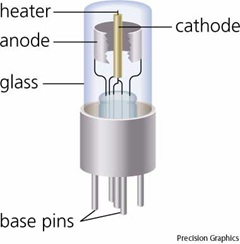
Image resolution: width=240 pixels, height=244 pixels. Find the location of `glass`. glass is located at coordinates (86, 74), (119, 102), (145, 62), (125, 8).